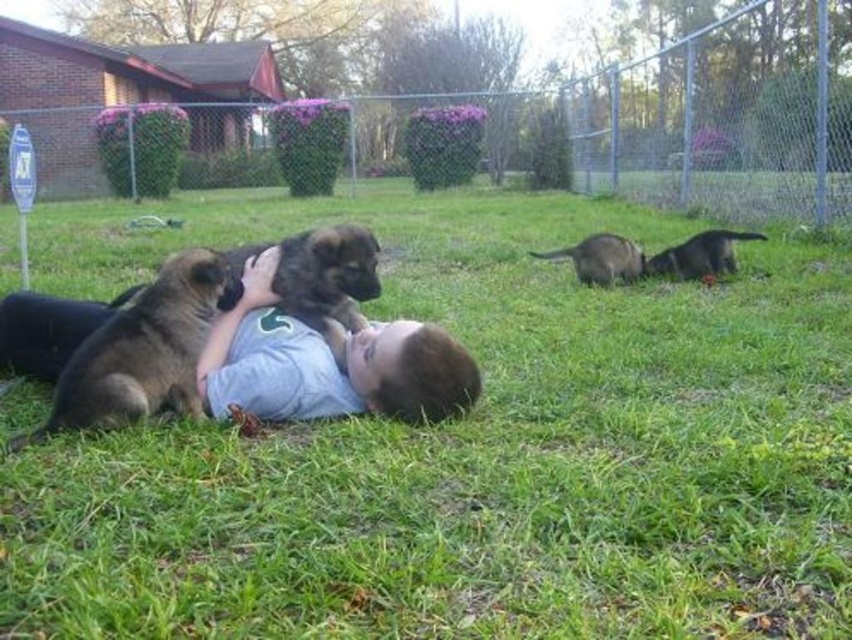
Question: Can you confirm if light blue shirt at center is positioned to the right of brown fur puppy at left?

Choices:
 (A) yes
 (B) no

Answer: (A)

Question: Which object is the farthest from the light blue shirt at center?

Choices:
 (A) green grass at center
 (B) brown fur dog at center
 (C) brown fur puppy at left

Answer: (B)

Question: Estimate the real-world distances between objects in this image. Which object is farther from the brown fur dog at right?

Choices:
 (A) light blue shirt at center
 (B) brown fur puppy at left
 (C) green grass at center
 (D) brown fur dog at center

Answer: (C)

Question: Is brown fur puppy at left smaller than brown fur dog at center?

Choices:
 (A) no
 (B) yes

Answer: (A)

Question: Which point is closer to the camera taking this photo?

Choices:
 (A) (668, 440)
 (B) (191, 394)
 (C) (718, 259)

Answer: (A)

Question: In this image, where is light blue shirt at center located relative to brown fur puppy at left?

Choices:
 (A) left
 (B) right

Answer: (B)